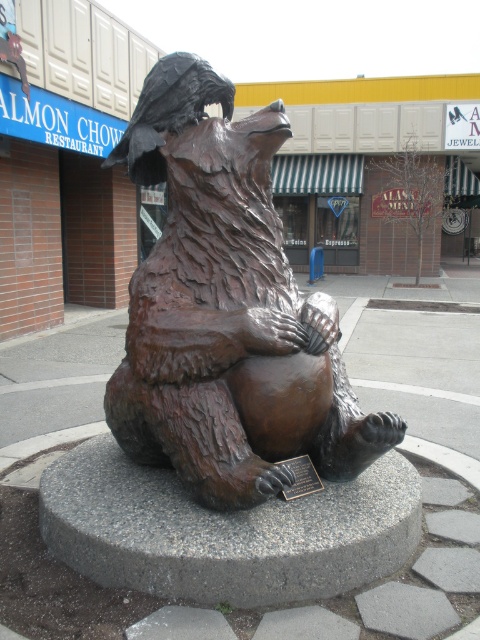
Find the location of a particular element. bronze bear statue at center is located at coordinates (227, 310).

Which of these two, bronze bear statue at center or bronze plaque at center, stands taller?

bronze bear statue at center

The image size is (480, 640). Identify the location of bronze bear statue at center. (227, 310).